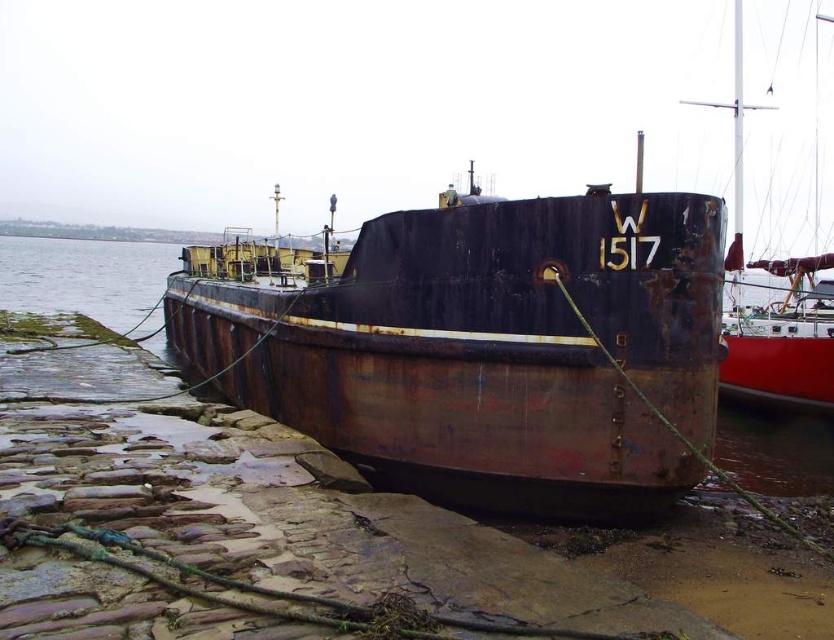
Question: Among these points, which one is farthest from the camera?

Choices:
 (A) (636, 460)
 (B) (737, 369)

Answer: (B)

Question: Is rusty metal boat at center positioned before rusty metal boat at right?

Choices:
 (A) no
 (B) yes

Answer: (B)

Question: Can you confirm if rusty metal boat at center is bigger than rusty metal boat at right?

Choices:
 (A) no
 (B) yes

Answer: (A)

Question: Is rusty metal boat at center wider than rusty metal boat at right?

Choices:
 (A) no
 (B) yes

Answer: (A)

Question: Which of the following is the farthest from the observer?

Choices:
 (A) (189, 291)
 (B) (789, 374)

Answer: (A)

Question: Which point is farther from the camera taking this photo?

Choices:
 (A) click(491, 413)
 (B) click(795, 316)

Answer: (B)